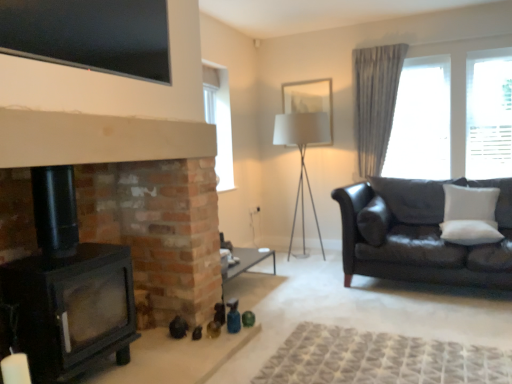
The image size is (512, 384). I want to click on free space above gray fabric curtain at upper right (from a real-world perspective), so click(x=373, y=45).